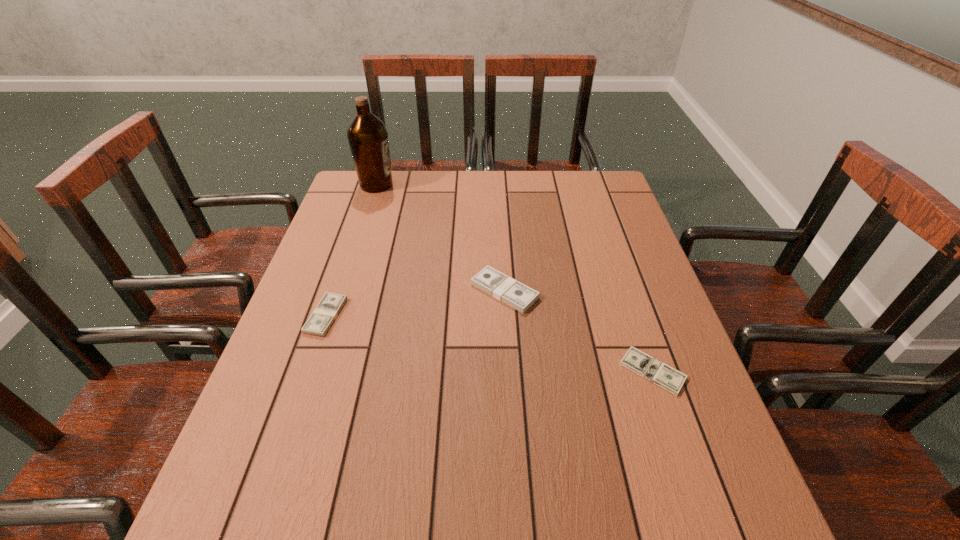
In order to click on vacant space that satisfies the following two spatial constraints: 1. on the label of the olive oil; 2. on the right side of the nearest object in this screenshot , I will do `click(316, 371)`.

This screenshot has width=960, height=540. In order to click on vacant space that satisfies the following two spatial constraints: 1. on the label of the tallest object; 2. on the left side of the second tallest object in this screenshot , I will do `click(342, 291)`.

At what (x,y) coordinates should I click in order to perform the action: click on free space in the image that satisfies the following two spatial constraints: 1. on the back side of the third object from left to right; 2. on the label of the olive oil. Please return your answer as a coordinate pair (x, y). The height and width of the screenshot is (540, 960). Looking at the image, I should click on (498, 185).